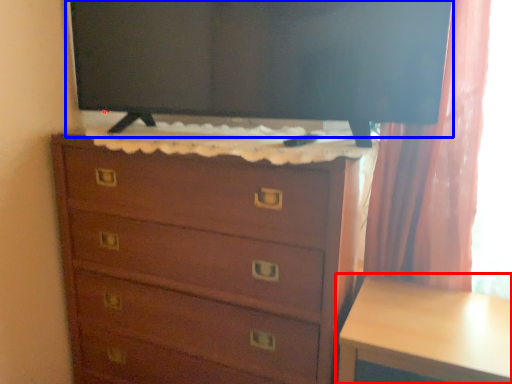
Question: Which point is closer to the camera, table (highlighted by a red box) or tv show (highlighted by a blue box)?

Choices:
 (A) table
 (B) tv show

Answer: (A)